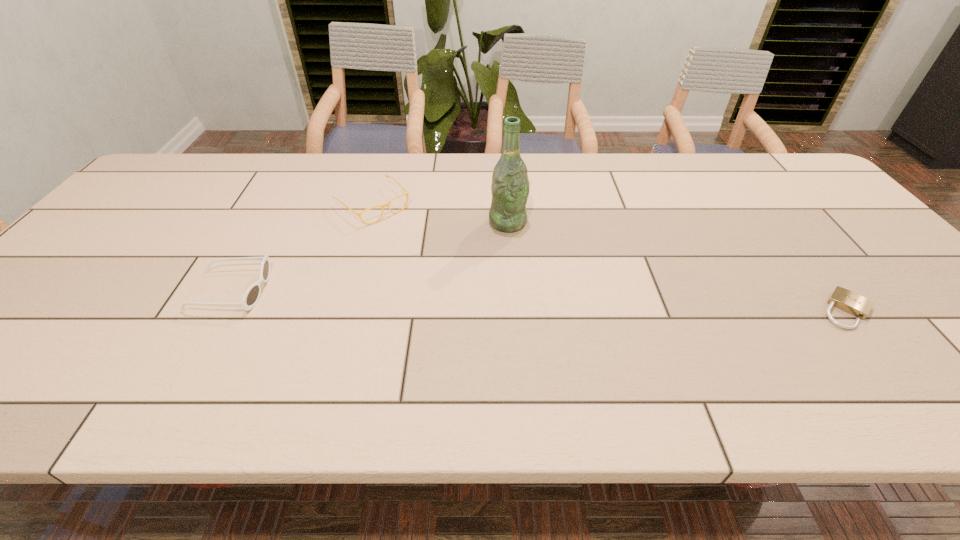
Find the location of a particular element. This screenshot has width=960, height=540. free space on the desktop that is between the sunglasses and the rightmost object and is positioned on the surface of the beer bottle is located at coordinates (574, 301).

The height and width of the screenshot is (540, 960). What are the coordinates of `free spot on the desktop that is between the leftmost object and the shortest object and is positioned in front of the lenses of the spectacles` in the screenshot? It's located at (477, 298).